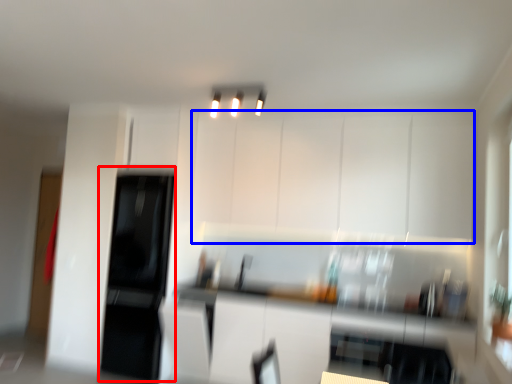
Question: Which object is closer to the camera taking this photo, appliance (highlighted by a red box) or cabinetry (highlighted by a blue box)?

Choices:
 (A) appliance
 (B) cabinetry

Answer: (B)